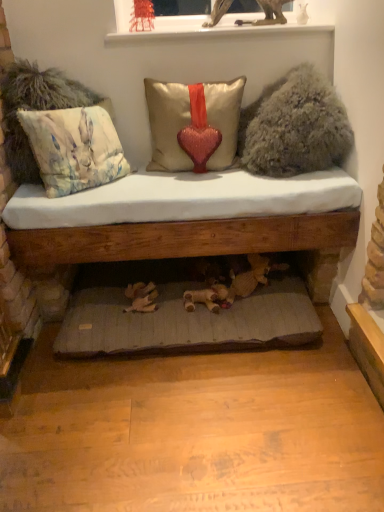
Question: Can you confirm if wooden bed frame at lower center is positioned to the left of gray fabric cushion at lower center?

Choices:
 (A) no
 (B) yes

Answer: (A)

Question: Can you confirm if wooden bed frame at lower center is wider than gray fabric cushion at lower center?

Choices:
 (A) no
 (B) yes

Answer: (A)

Question: Is wooden bed frame at lower center shorter than gray fabric cushion at lower center?

Choices:
 (A) no
 (B) yes

Answer: (A)

Question: From a real-world perspective, is wooden bed frame at lower center on gray fabric cushion at lower center?

Choices:
 (A) no
 (B) yes

Answer: (B)

Question: Does wooden bed frame at lower center come in front of gray fabric cushion at lower center?

Choices:
 (A) no
 (B) yes

Answer: (A)

Question: Relative to white glossy window sill at upper center, is wooden bed frame at lower center in front or behind?

Choices:
 (A) behind
 (B) front

Answer: (B)

Question: In terms of height, does wooden bed frame at lower center look taller or shorter compared to white glossy window sill at upper center?

Choices:
 (A) tall
 (B) short

Answer: (A)

Question: Considering the positions of wooden bed frame at lower center and white glossy window sill at upper center in the image, is wooden bed frame at lower center wider or thinner than white glossy window sill at upper center?

Choices:
 (A) thin
 (B) wide

Answer: (B)

Question: Based on their sizes in the image, would you say wooden bed frame at lower center is bigger or smaller than white glossy window sill at upper center?

Choices:
 (A) small
 (B) big

Answer: (B)

Question: Relative to pastel floral fabric cushion at left, acting as the second pillow starting from the right, is white glossy window sill at upper center in front or behind?

Choices:
 (A) front
 (B) behind

Answer: (B)

Question: Is white glossy window sill at upper center wider or thinner than pastel floral fabric cushion at left, acting as the second pillow starting from the right?

Choices:
 (A) wide
 (B) thin

Answer: (A)

Question: Considering the positions of white glossy window sill at upper center and pastel floral fabric cushion at left, arranged as the 1th pillow when viewed from the left, in the image, is white glossy window sill at upper center bigger or smaller than pastel floral fabric cushion at left, arranged as the 1th pillow when viewed from the left,?

Choices:
 (A) big
 (B) small

Answer: (B)

Question: From the image's perspective, relative to pastel floral fabric cushion at left, acting as the second pillow starting from the right, is white glossy window sill at upper center above or below?

Choices:
 (A) above
 (B) below

Answer: (A)

Question: Is satin/velvet pillow with heart at center, which appears as the second pillow when viewed from the left, taller or shorter than fuzzy beige pillow at upper right?

Choices:
 (A) short
 (B) tall

Answer: (A)

Question: Based on their sizes in the image, would you say satin/velvet pillow with heart at center, which appears as the second pillow when viewed from the left, is bigger or smaller than fuzzy beige pillow at upper right?

Choices:
 (A) small
 (B) big

Answer: (A)